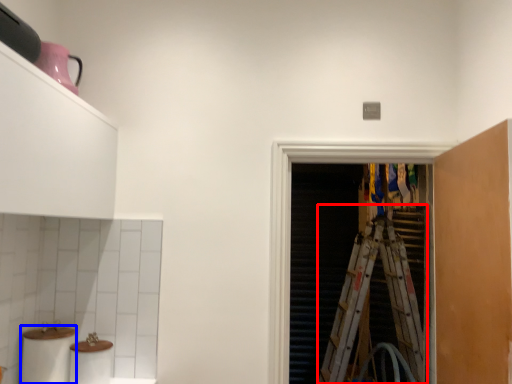
Question: Which object appears closest to the camera in this image, ladder (highlighted by a red box) or toilet paper (highlighted by a blue box)?

Choices:
 (A) ladder
 (B) toilet paper

Answer: (B)